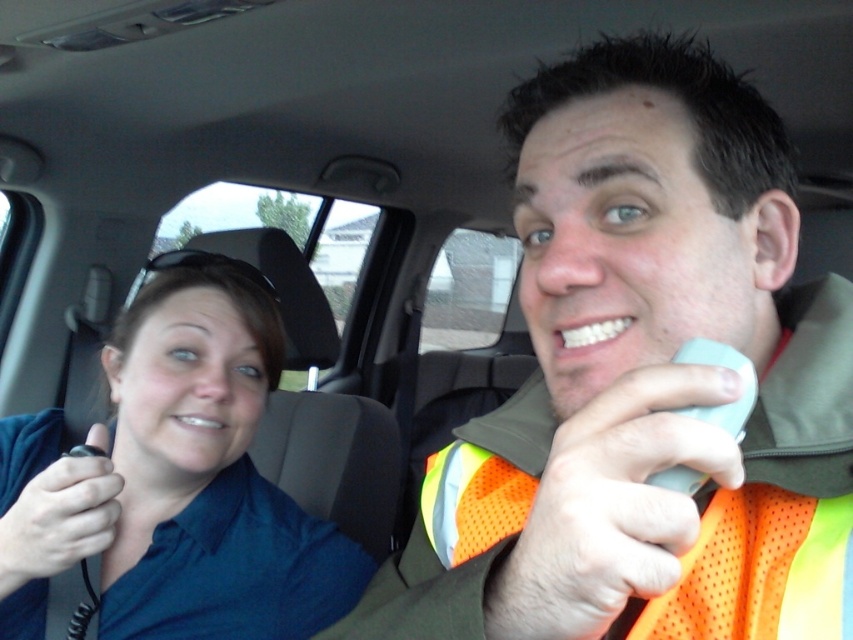
Is blue fabric shirt at left above orange mesh safety vest at center?

Incorrect, blue fabric shirt at left is not positioned above orange mesh safety vest at center.

Does blue fabric shirt at left have a smaller size compared to orange mesh safety vest at center?

No, blue fabric shirt at left is not smaller than orange mesh safety vest at center.

Locate an element on the screen. The width and height of the screenshot is (853, 640). blue fabric shirt at left is located at coordinates (177, 483).